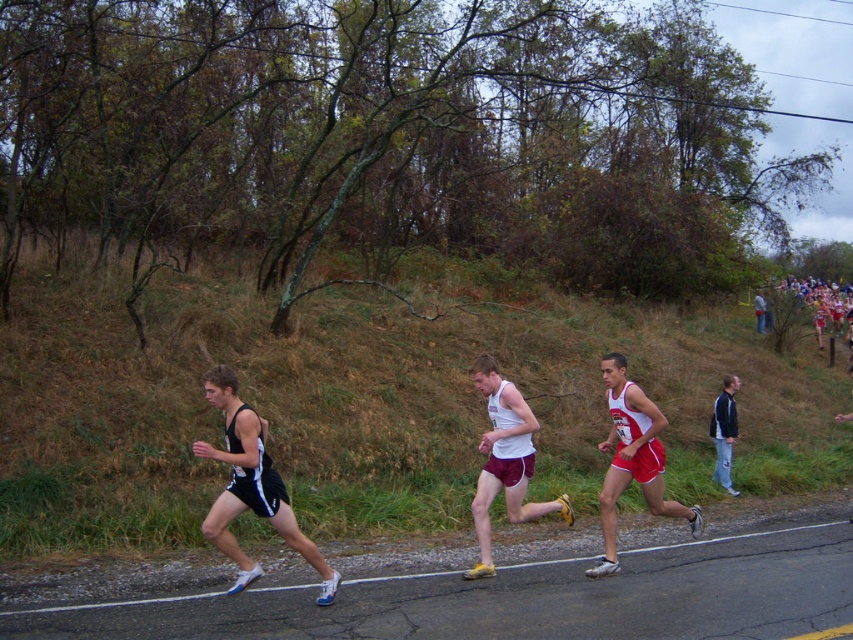
You are a spectator at the race and want to take a photo of both the white matte tank top at center and the red fabric jacket at right. Which runner should you focus on first if you want to capture them from left to right in the frame?

You should focus on the white matte tank top at center first because it is positioned to the left of the red fabric jacket at right, so capturing them from left to right would require starting with the one on the left.

You are a photographer at the race and want to capture a photo of both the blue fabric jacket at right and the red fabric jacket at right. Which jacket should you focus on first to ensure both are in the frame?

The blue fabric jacket at right is positioned on the left side of the red fabric jacket at right, so you should focus on the blue fabric jacket at right first to ensure both are in the frame.

You are a photographer positioned at the camera location capturing this running event. You want to ensure that the point at coordinates point [509,500] is in focus. Given that your camera has a depth of field that can sharply capture objects within 7 meters from the focal point, should you adjust your focus to this point to keep it sharp?

The point at coordinates point [509,500] is 8.06 meters away from the camera. Since the depth of field can only sharply capture objects within 7 meters, adjusting the focus to this point would place it just beyond the optimal range, resulting in slight blurriness. To keep it sharp, you should adjust your focus to a point closer than 8.06 meters or use a different camera setting to extend the depth of field.